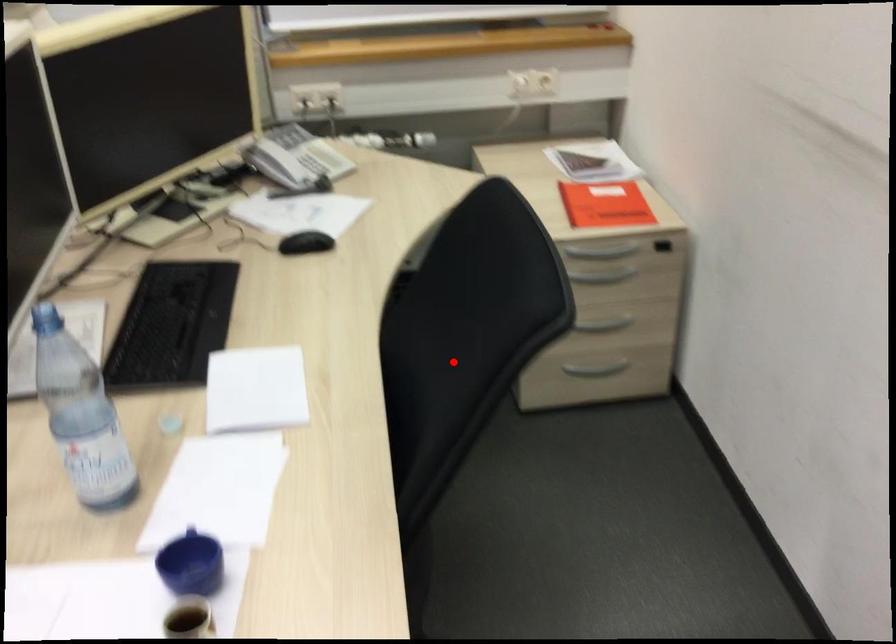
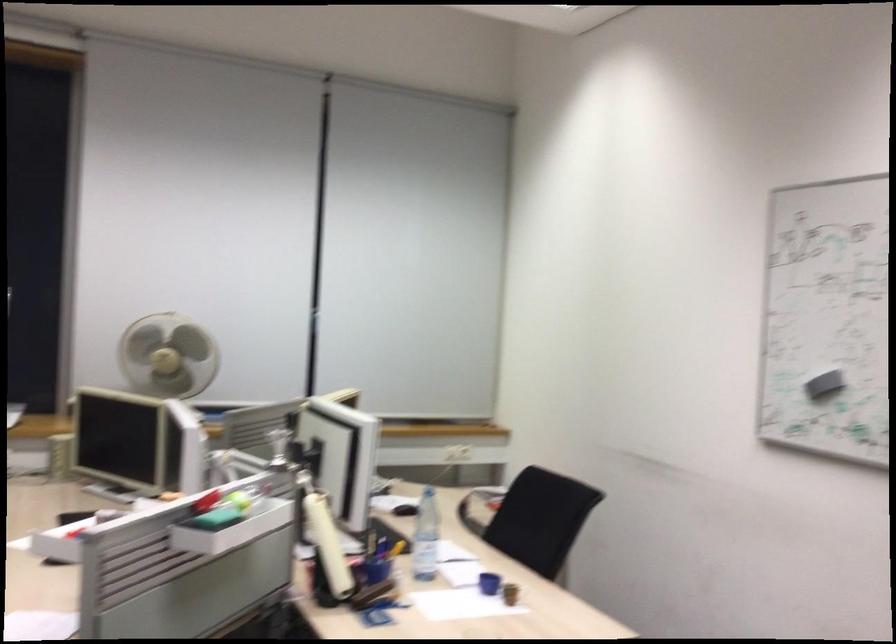
In the second image, find the point that corresponds to the highlighted location in the first image.

(531, 518)